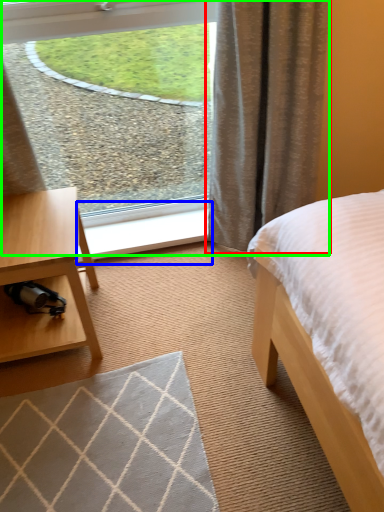
Question: Estimate the real-world distances between objects in this image. Which object is closer to curtain (highlighted by a red box), window sill (highlighted by a blue box) or window (highlighted by a green box)?

Choices:
 (A) window sill
 (B) window

Answer: (B)